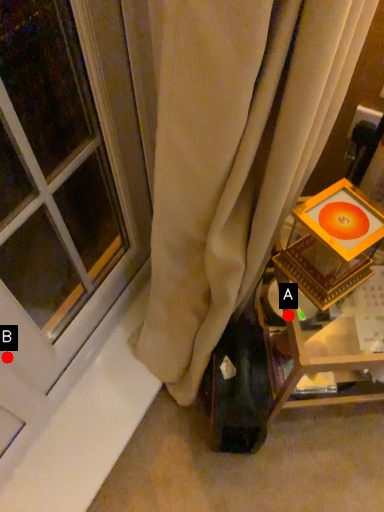
Question: Two points are circled on the image, labeled by A and B beside each circle. Which of the following is the farthest from the observer?

Choices:
 (A) A is further
 (B) B is further

Answer: (B)